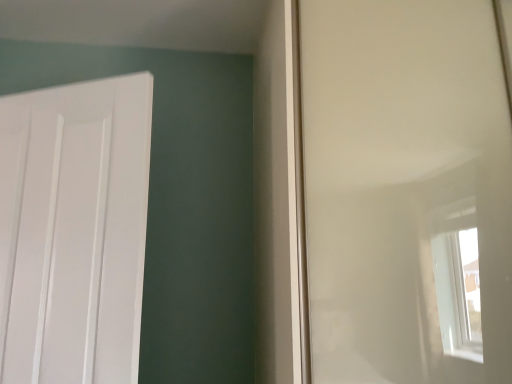
Question: Looking at their shapes, would you say white matte door at left is wider or thinner than transparent plastic window screen at right?

Choices:
 (A) thin
 (B) wide

Answer: (A)

Question: Considering the positions of point (55, 188) and point (321, 251), is point (55, 188) closer or farther from the camera than point (321, 251)?

Choices:
 (A) closer
 (B) farther

Answer: (B)

Question: Relative to transparent plastic window screen at right, is white matte door at left in front or behind?

Choices:
 (A) behind
 (B) front

Answer: (A)

Question: Considering their positions, is transparent plastic window screen at right located in front of or behind white matte door at left?

Choices:
 (A) front
 (B) behind

Answer: (A)

Question: In terms of height, does transparent plastic window screen at right look taller or shorter compared to white matte door at left?

Choices:
 (A) tall
 (B) short

Answer: (A)

Question: From the image's perspective, relative to white matte door at left, is transparent plastic window screen at right above or below?

Choices:
 (A) below
 (B) above

Answer: (B)

Question: From a real-world perspective, is transparent plastic window screen at right above or below white matte door at left?

Choices:
 (A) above
 (B) below

Answer: (A)